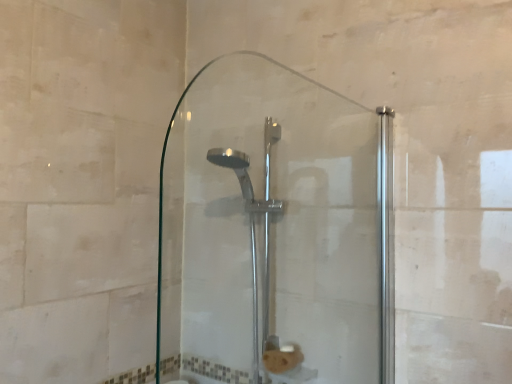
Question: From a real-world perspective, is polished chrome shower head at center positioned above or below clear glass shower door at center?

Choices:
 (A) above
 (B) below

Answer: (B)

Question: In terms of width, does polished chrome shower head at center look wider or thinner when compared to clear glass shower door at center?

Choices:
 (A) thin
 (B) wide

Answer: (B)

Question: Do you think polished chrome shower head at center is within clear glass shower door at center, or outside of it?

Choices:
 (A) outside
 (B) inside

Answer: (A)

Question: Based on their sizes in the image, would you say clear glass shower door at center is bigger or smaller than polished chrome shower head at center?

Choices:
 (A) big
 (B) small

Answer: (B)

Question: From the image's perspective, is clear glass shower door at center above or below polished chrome shower head at center?

Choices:
 (A) below
 (B) above

Answer: (B)

Question: Looking at their shapes, would you say clear glass shower door at center is wider or thinner than polished chrome shower head at center?

Choices:
 (A) wide
 (B) thin

Answer: (B)

Question: Is clear glass shower door at center taller or shorter than polished chrome shower head at center?

Choices:
 (A) short
 (B) tall

Answer: (A)